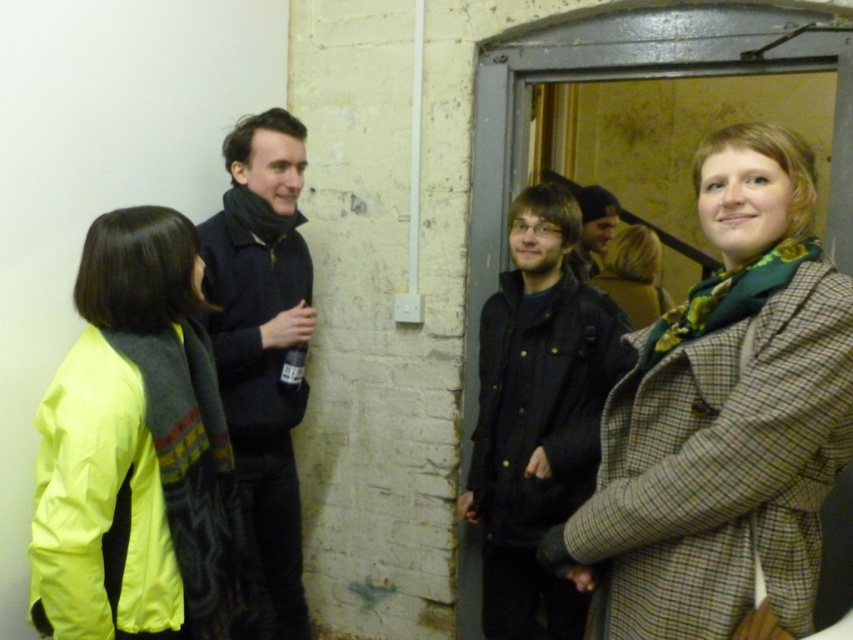
You are a photographer trying to capture a group photo of the people in the scene. You need to position yourself so that you can include both the green plaid coat at center and the green plaid coat at right in the frame. Given that your camera has a maximum horizontal field of view of 1.5 meters, will you be able to fit both coats into the shot?

The distance between the green plaid coat at center and the green plaid coat at right is 1.76 meters. Since the camera can only capture up to 1.5 meters horizontally, the photographer will not be able to fit both coats into the frame.

You are organizing a clothing donation drive and need to determine which item takes up more space in the donation box. Based on the image, which item between the dark blue sweater at center and the dark gray jacket at center is wider?

The dark blue sweater at center is wider than the dark gray jacket at center, so it takes up more space in the donation box.

You are organizing a photo shoot and want to ensure that the green plaid coat at center and the dark blue sweater at center are both visible in the final image. Based on their positions, which clothing item is covering part of the other?

The green plaid coat at center is positioned over the dark blue sweater at center, so it is covering part of it.